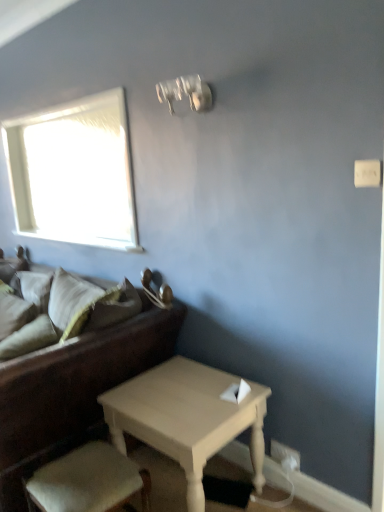
At what (x,y) coordinates should I click in order to perform the action: click on free location above light beige fabric armchair at lower left (from a real-world perspective). Please return your answer as a coordinate pair (x, y). Image resolution: width=384 pixels, height=512 pixels. Looking at the image, I should click on (81, 472).